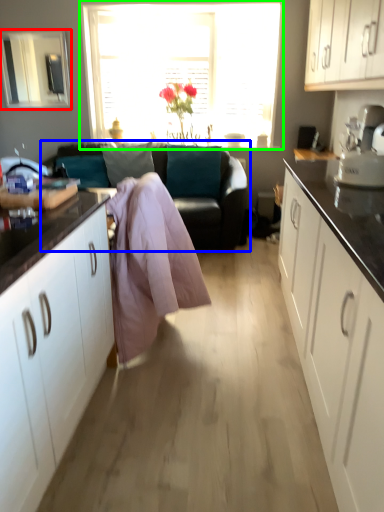
Question: Which object is the farthest from window screen (highlighted by a red box)? Choose among these: studio couch (highlighted by a blue box) or window (highlighted by a green box).

Choices:
 (A) studio couch
 (B) window

Answer: (A)